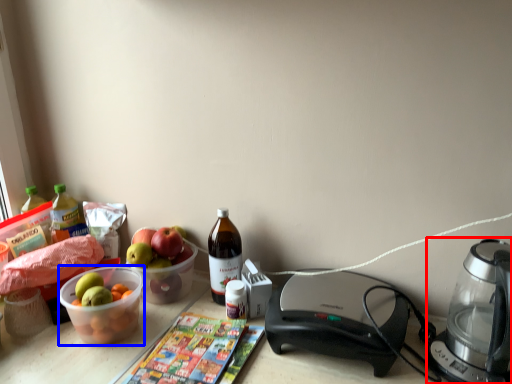
Question: Which object is further to the camera taking this photo, coffee maker (highlighted by a red box) or bowl (highlighted by a blue box)?

Choices:
 (A) coffee maker
 (B) bowl

Answer: (B)